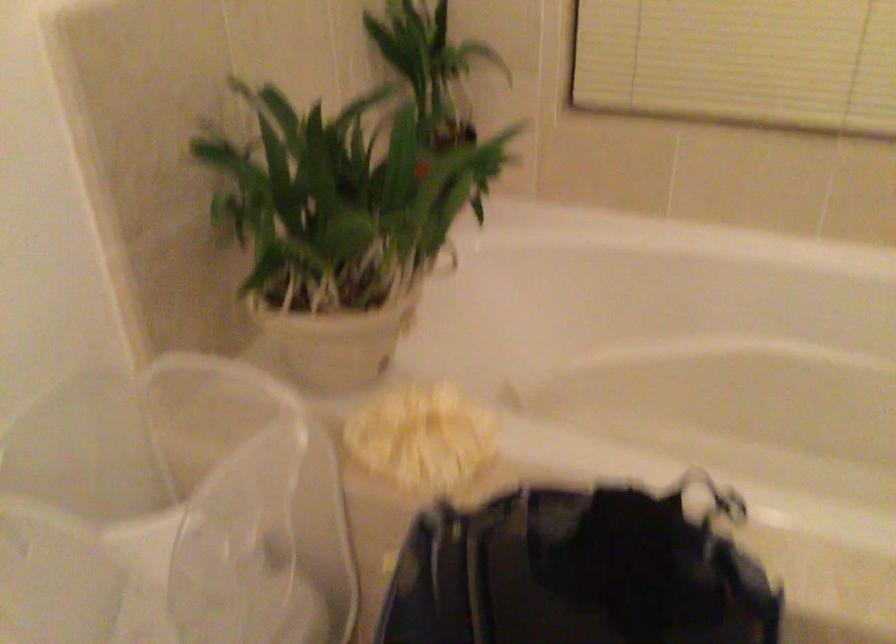
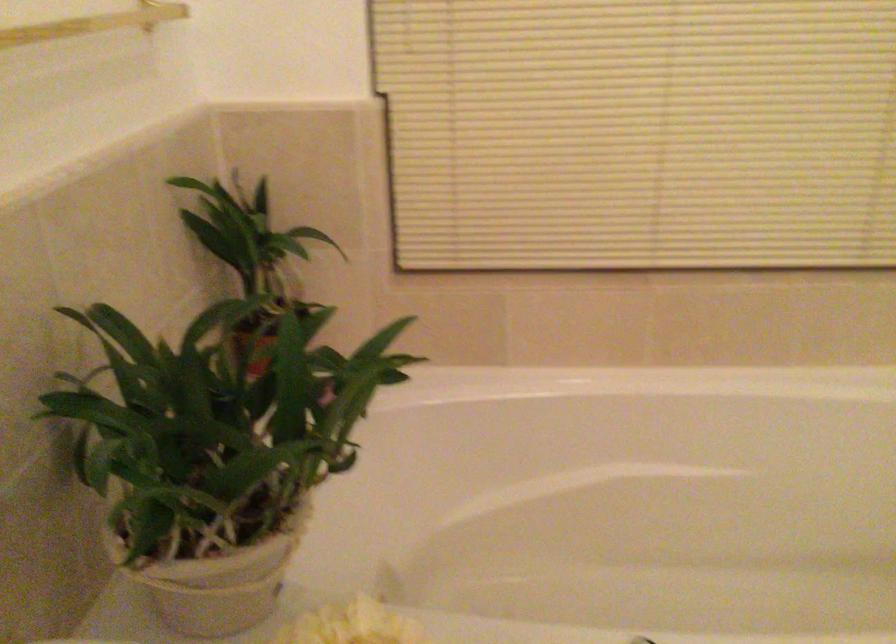
Where in the second image is the point corresponding to the point at 431,404 from the first image?

(351, 625)